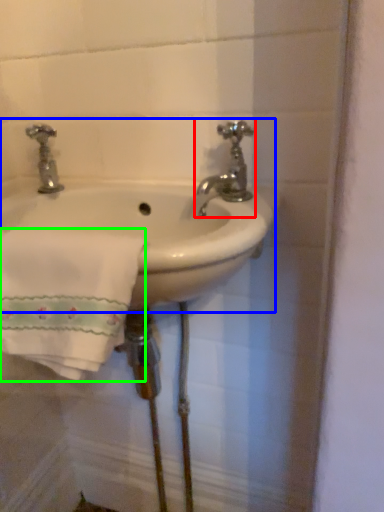
Question: Which object is positioned farthest from tap (highlighted by a red box)? Select from sink (highlighted by a blue box) and bath towel (highlighted by a green box).

Choices:
 (A) sink
 (B) bath towel

Answer: (B)